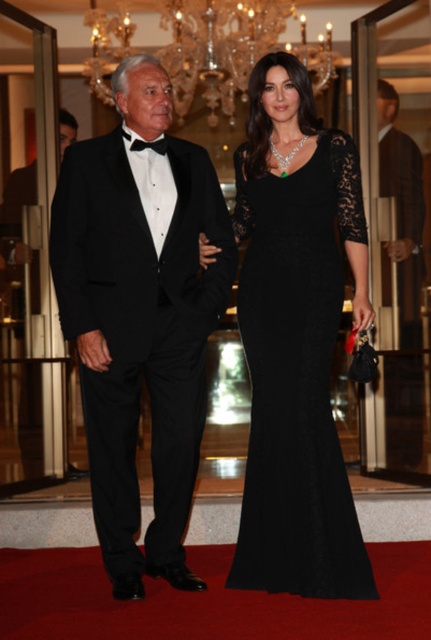
Can you confirm if black lace dress at center is bigger than black satin bow tie at center?

Yes.

Can you confirm if black lace dress at center is wider than black satin bow tie at center?

Yes, black lace dress at center is wider than black satin bow tie at center.

Measure the distance between black lace dress at center and camera.

They are 3.56 meters apart.

At what (x,y) coordinates should I click in order to perform the action: click on black lace dress at center. Please return your answer as a coordinate pair (x, y). The width and height of the screenshot is (431, 640). Looking at the image, I should click on (296, 376).

Does matte black tuxedo at left appear over black lace dress at center?

Indeed, matte black tuxedo at left is positioned over black lace dress at center.

Which is more to the right, matte black tuxedo at left or black lace dress at center?

Positioned to the right is black lace dress at center.

The width and height of the screenshot is (431, 640). I want to click on matte black tuxedo at left, so click(296, 340).

This screenshot has height=640, width=431. I want to click on matte black tuxedo at left, so click(x=296, y=340).

Can you confirm if smooth brown leather coat at right is wider than black satin bow tie at center?

Correct, the width of smooth brown leather coat at right exceeds that of black satin bow tie at center.

Is smooth brown leather coat at right thinner than black satin bow tie at center?

No.

Where is `smooth brown leather coat at right`? The width and height of the screenshot is (431, 640). smooth brown leather coat at right is located at coordinates (402, 216).